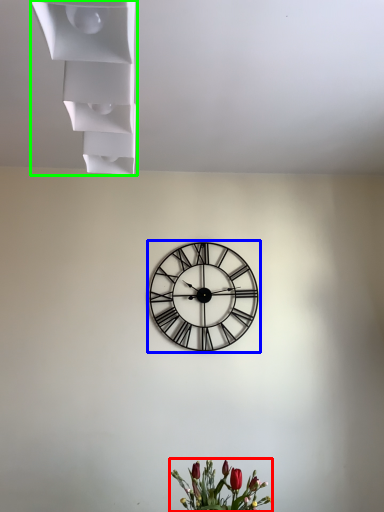
Question: Which is farther away from floral arrangement (highlighted by a red box)? wall clock (highlighted by a blue box) or shelf (highlighted by a green box)?

Choices:
 (A) wall clock
 (B) shelf

Answer: (B)